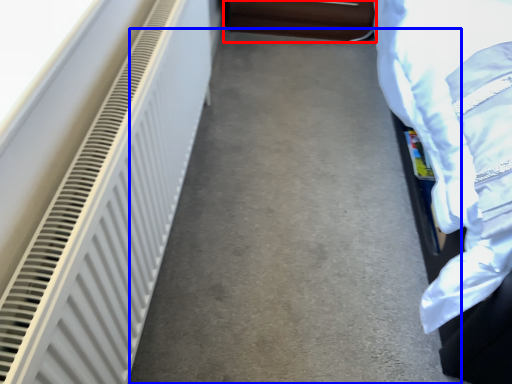
Question: Which object appears farthest to the camera in this image, furniture (highlighted by a red box) or concrete (highlighted by a blue box)?

Choices:
 (A) furniture
 (B) concrete

Answer: (A)